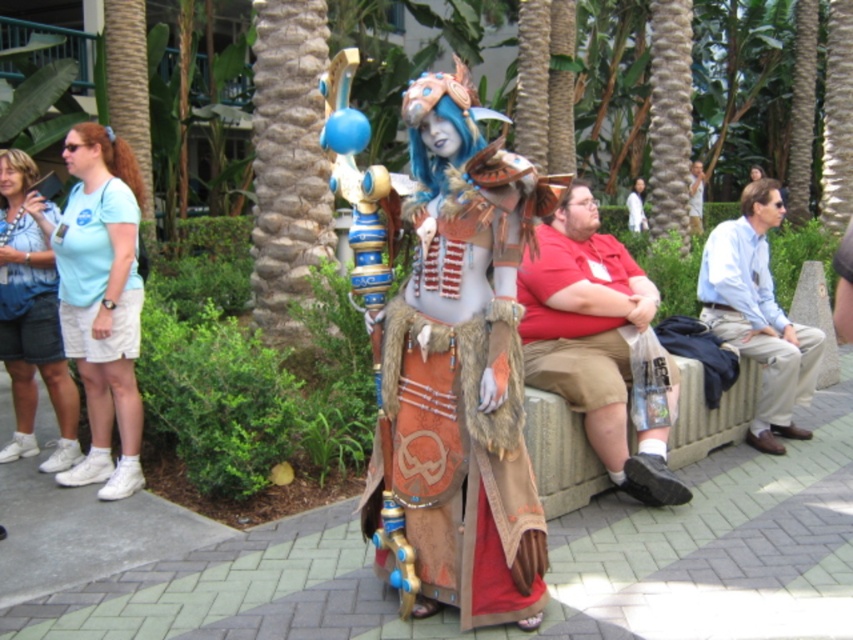
Is light blue shirt at right above denim shorts at left?

No.

Does light blue shirt at right have a greater width compared to denim shorts at left?

Correct, the width of light blue shirt at right exceeds that of denim shorts at left.

Does point (711, 246) come behind point (62, 356)?

Yes, point (711, 246) is farther from viewer.

The height and width of the screenshot is (640, 853). In order to click on light blue shirt at right in this screenshot , I will do `click(758, 316)`.

Does point (780, 221) lie behind point (631, 209)?

No, (780, 221) is closer to viewer.

Between point (798, 397) and point (636, 204), which one is positioned in front?

Point (798, 397) is in front.

Is point (802, 340) positioned in front of point (640, 202)?

Yes.

At what (x,y) coordinates should I click in order to perform the action: click on light blue shirt at right. Please return your answer as a coordinate pair (x, y). The width and height of the screenshot is (853, 640). Looking at the image, I should click on (758, 316).

Is light blue fabric shirt at upper left taller than matte blue shirt at left?

Yes.

Is point (90, 276) in front of point (48, 337)?

Yes, point (90, 276) is closer to viewer.

This screenshot has height=640, width=853. What are the coordinates of `light blue fabric shirt at upper left` in the screenshot? It's located at (100, 298).